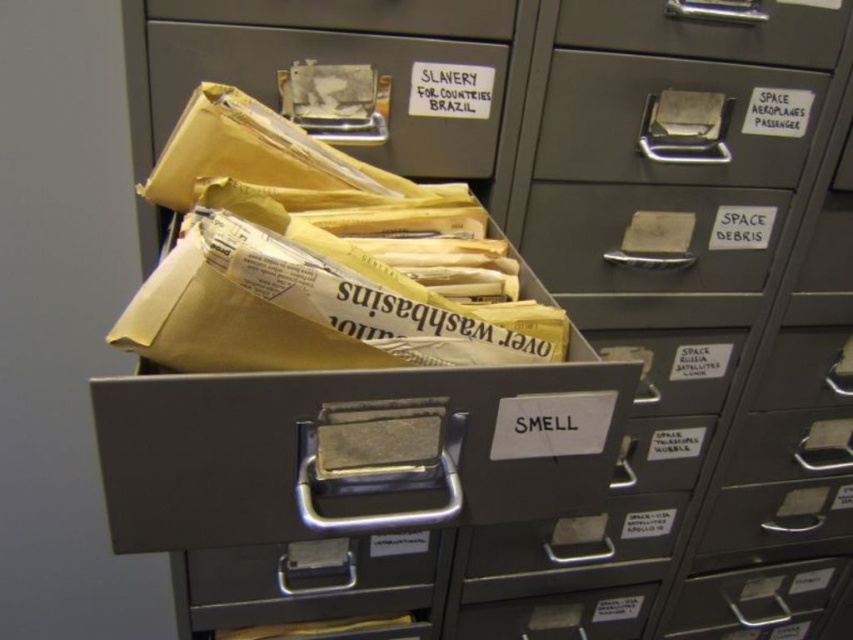
Question: Does matte cardboard drawer at upper center appear on the left side of brushed metal drawer at upper center?

Choices:
 (A) yes
 (B) no

Answer: (A)

Question: Which point appears farthest from the camera in this image?

Choices:
 (A) (723, 22)
 (B) (444, 138)
 (C) (705, 237)
 (D) (643, 161)

Answer: (C)

Question: Is metallic gray drawer at upper center above brushed metal drawer at upper center?

Choices:
 (A) no
 (B) yes

Answer: (B)

Question: From the image, what is the correct spatial relationship of metallic gray drawer at upper right in relation to brushed metal drawer at upper center?

Choices:
 (A) left
 (B) right

Answer: (B)

Question: Which of the following is the closest to the observer?

Choices:
 (A) metallic gray drawer at upper center
 (B) matte cardboard drawer at upper center

Answer: (B)

Question: Which point is closer to the camera taking this photo?

Choices:
 (A) (659, 200)
 (B) (669, 4)
 (C) (323, 13)

Answer: (C)